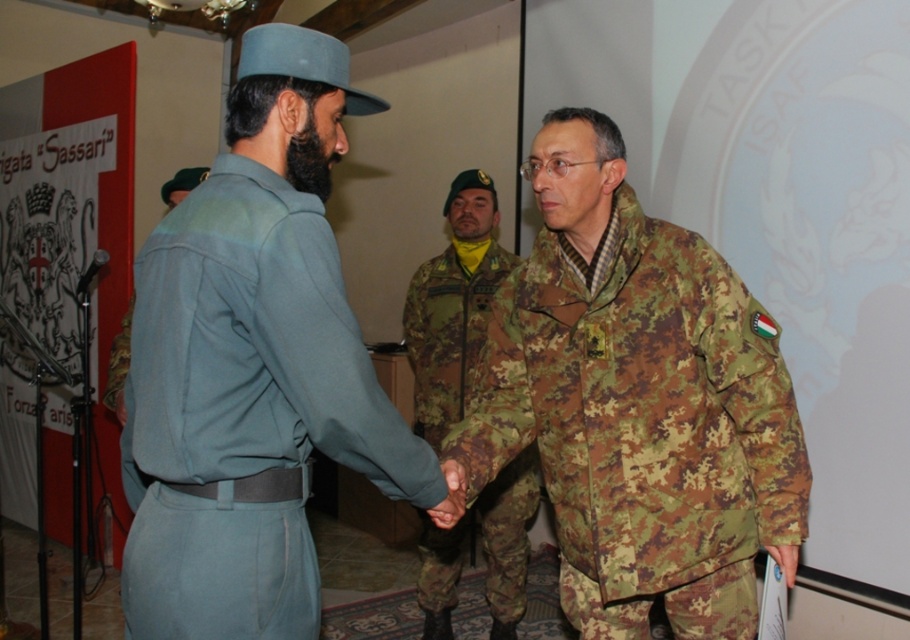
Is camouflage fabric jacket at center taller than camouflage fabric uniform at center?

Yes.

Measure the distance between point (619, 442) and camera.

Point (619, 442) and camera are 5.88 feet apart from each other.

Image resolution: width=910 pixels, height=640 pixels. Identify the location of camouflage fabric jacket at center. (642, 424).

Find the location of `camouflage fabric jacket at center`. camouflage fabric jacket at center is located at coordinates (642, 424).

Which is below, light blue uniform at center or camouflage fabric jacket at center?

Positioned lower is camouflage fabric jacket at center.

Is light blue uniform at center to the right of camouflage fabric jacket at center from the viewer's perspective?

Incorrect, light blue uniform at center is not on the right side of camouflage fabric jacket at center.

Find the location of a particular element. Image resolution: width=910 pixels, height=640 pixels. light blue uniform at center is located at coordinates (254, 365).

Can you confirm if light blue uniform at center is taller than camouflage fabric uniform at center?

Yes.

Which of these two, light blue uniform at center or camouflage fabric uniform at center, stands taller?

light blue uniform at center

Between point (276, 52) and point (430, 301), which one is positioned behind?

Positioned behind is point (430, 301).

Find the location of `light blue uniform at center`. light blue uniform at center is located at coordinates (254, 365).